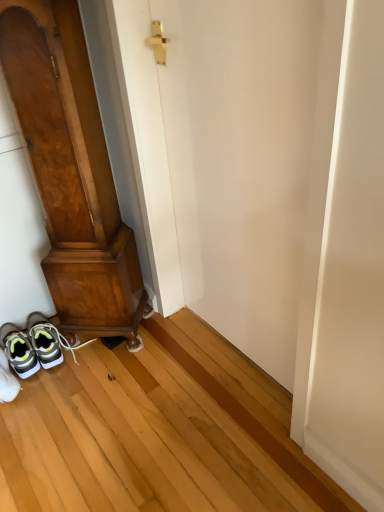
The width and height of the screenshot is (384, 512). In order to click on vacant area located to the right-hand side of wooden door at left, the second door in the right-to-left sequence in this screenshot , I will do `click(162, 346)`.